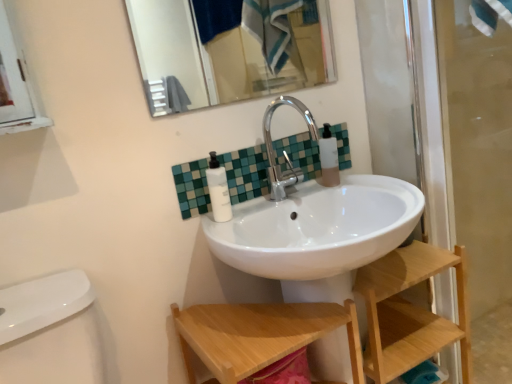
Question: In terms of height, does green mosaic tile at center look taller or shorter compared to translucent plastic bottle at upper right, which is counted as the 1th toiletry, starting from the back?

Choices:
 (A) tall
 (B) short

Answer: (B)

Question: Would you say green mosaic tile at center is to the left or to the right of translucent plastic bottle at upper right, which is counted as the 1th toiletry, starting from the back, in the picture?

Choices:
 (A) left
 (B) right

Answer: (A)

Question: Which of these objects is positioned closest to the metallic silver mirror at upper center?

Choices:
 (A) translucent plastic bottle at upper right, which is counted as the 1th toiletry, starting from the back
 (B) white matte pump bottle at center, positioned as the 2th toiletry in right-to-left order
 (C) wooden shelf at lower right
 (D) wooden step stool at lower center
 (E) transparent glass screen door at right

Answer: (E)

Question: Considering the real-world distances, which object is farthest from the metallic silver mirror at upper center?

Choices:
 (A) wooden shelf at lower right
 (B) transparent glass screen door at right
 (C) translucent plastic bottle at upper right, which is counted as the 2th toiletry, starting from the left
 (D) silver metallic faucet at center
 (E) white matte pump bottle at center, arranged as the second toiletry when viewed from the back

Answer: (E)